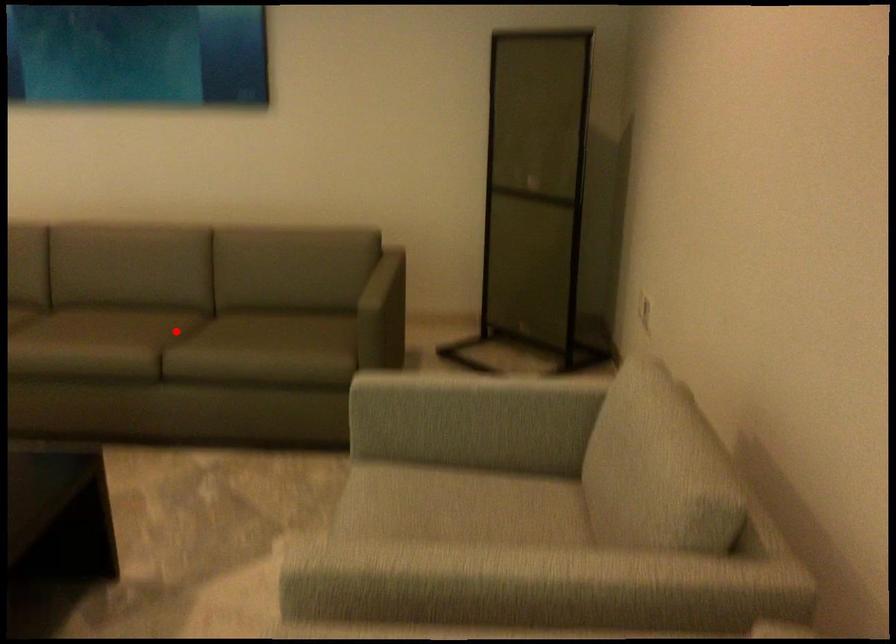
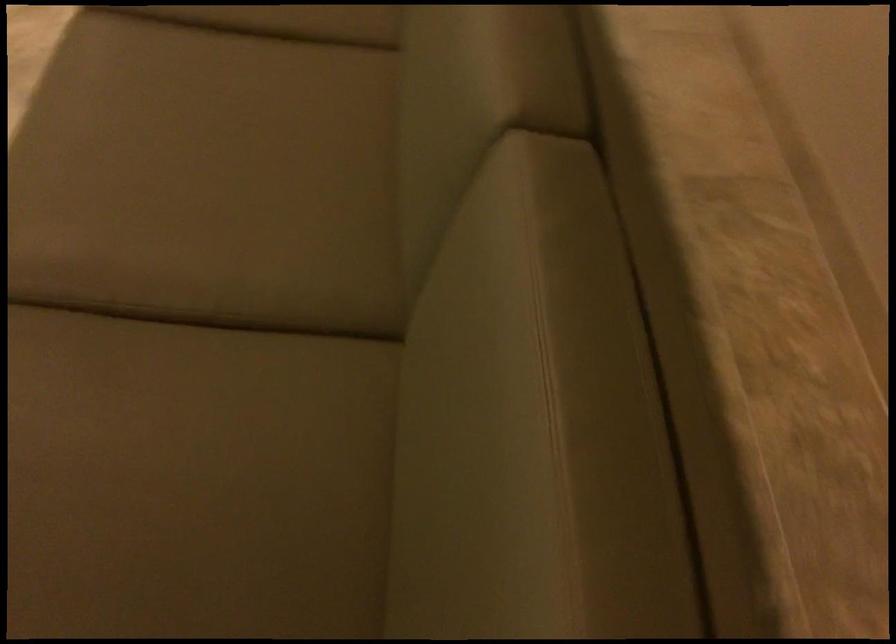
Question: I am providing you with two images of the same scene from different viewpoints. Given a red point in image1, look at the same physical point in image2. Is it:

Choices:
 (A) Closer to the viewpoint
 (B) Farther from the viewpoint

Answer: (A)